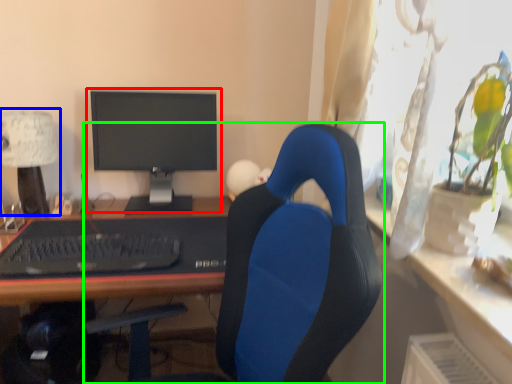
Question: Considering the real-world distances, which object is farthest from computer monitor (highlighted by a red box)? table lamp (highlighted by a blue box) or chair (highlighted by a green box)?

Choices:
 (A) table lamp
 (B) chair

Answer: (B)